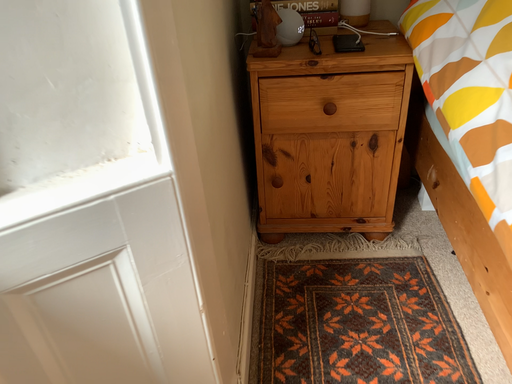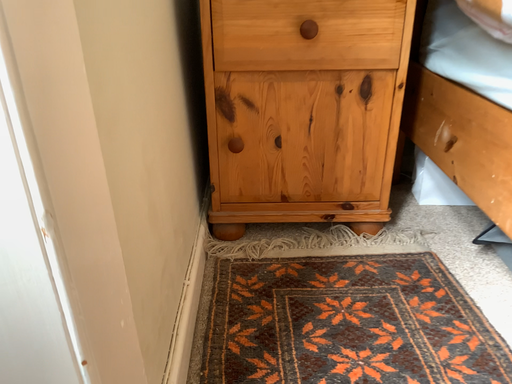
Question: Which way did the camera rotate in the video?

Choices:
 (A) rotated downward
 (B) rotated upward

Answer: (B)